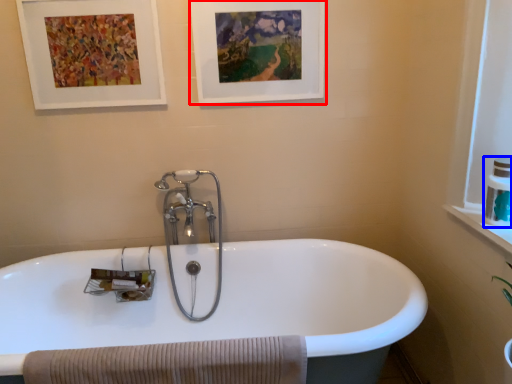
Question: Which of the following is the closest to the observer, picture frame (highlighted by a red box) or toiletry (highlighted by a blue box)?

Choices:
 (A) picture frame
 (B) toiletry

Answer: (B)